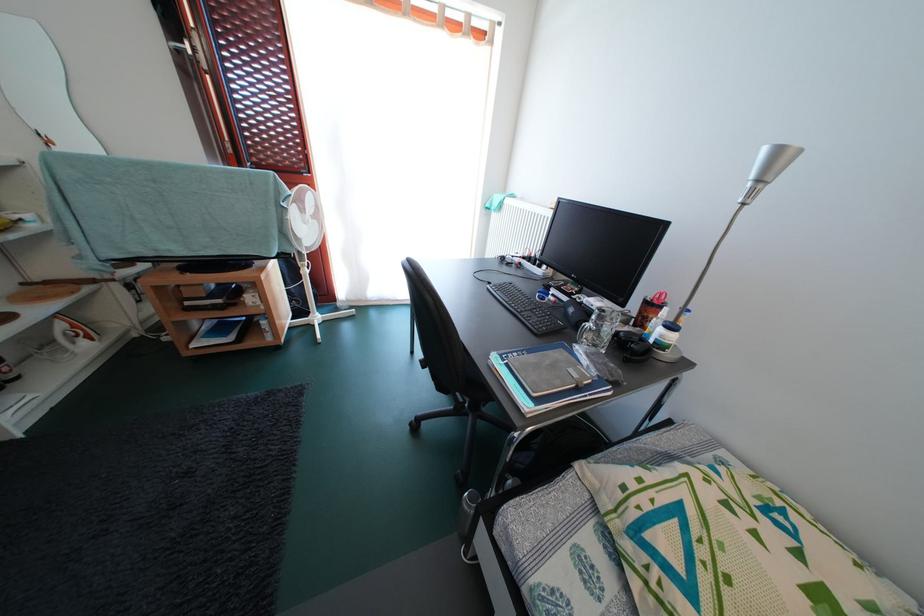
Describe the element at coordinates (649, 309) in the screenshot. This screenshot has width=924, height=616. I see `the red pen holder` at that location.